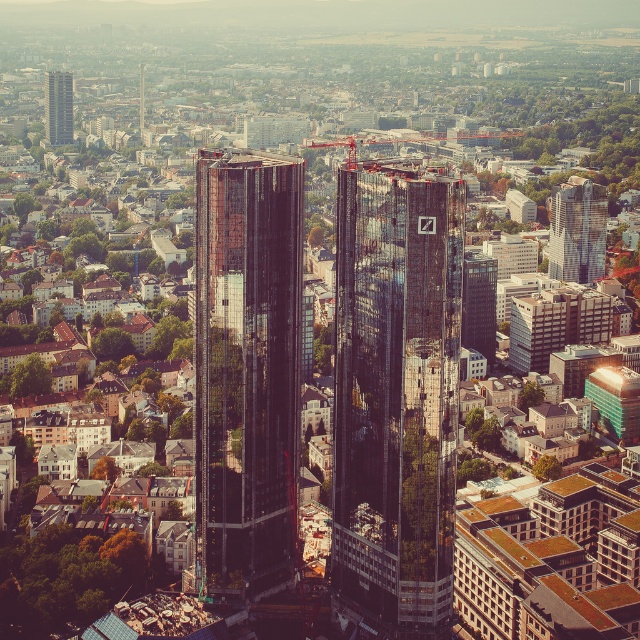
Question: Which of these objects is positioned farthest from the metallic red crane at center?

Choices:
 (A) reflective glass skyscraper at upper right
 (B) glossy glass tower at center

Answer: (A)

Question: Among these points, which one is nearest to the camera?

Choices:
 (A) (205, 520)
 (B) (340, 140)

Answer: (A)

Question: Among these points, which one is nearest to the camera?

Choices:
 (A) (280, 168)
 (B) (51, 106)
 (C) (360, 192)

Answer: (C)

Question: Can you confirm if glassy reflective skyscraper at upper left is positioned above metallic red crane at center?

Choices:
 (A) no
 (B) yes

Answer: (B)

Question: Is glossy glass tower at center smaller than metallic red crane at center?

Choices:
 (A) yes
 (B) no

Answer: (A)

Question: In this image, where is reflective glass skyscraper at upper right located relative to metallic red crane at center?

Choices:
 (A) above
 (B) below

Answer: (B)